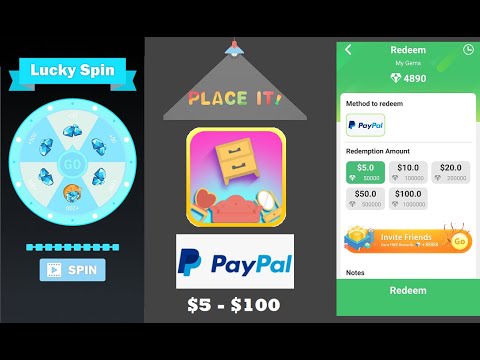
Where is `lower drawer`? lower drawer is located at coordinates (251, 165).